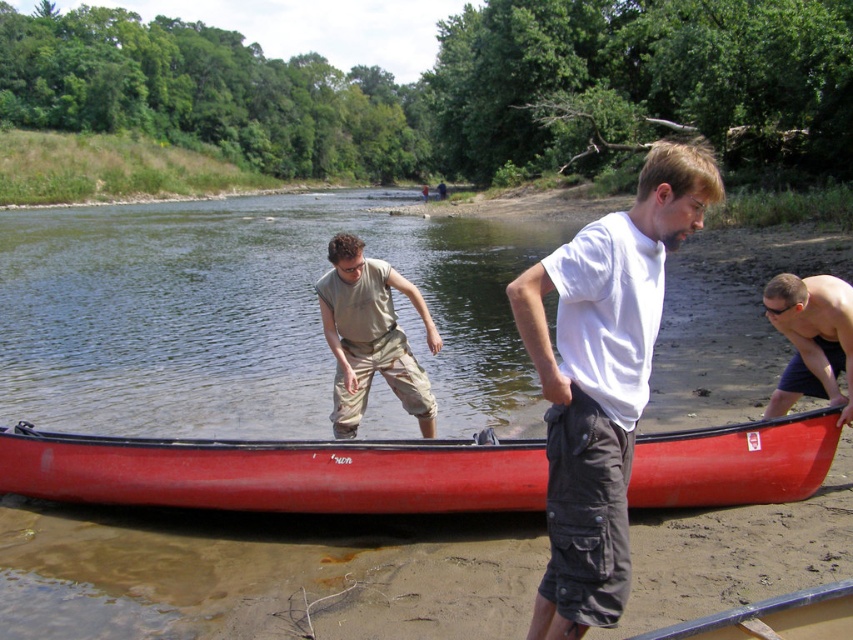
Question: Does shiny red canoe at center lie in front of khaki cotton pants at center?

Choices:
 (A) no
 (B) yes

Answer: (B)

Question: Which point is farther to the camera?

Choices:
 (A) (596, 600)
 (B) (366, 467)
 (C) (393, 314)

Answer: (C)

Question: Which object appears closest to the camera in this image?

Choices:
 (A) khaki cotton pants at center
 (B) shiny black skin at lower right
 (C) white cotton shirt at center
 (D) shiny red canoe at center

Answer: (C)

Question: Where is shiny red canoe at center located in relation to white cotton shirt at center in the image?

Choices:
 (A) right
 (B) left

Answer: (B)

Question: Which point appears closest to the camera in this image?

Choices:
 (A) (426, 426)
 (B) (19, 492)
 (C) (821, 344)

Answer: (C)

Question: Does white cotton shirt at center appear over shiny black skin at lower right?

Choices:
 (A) no
 (B) yes

Answer: (A)